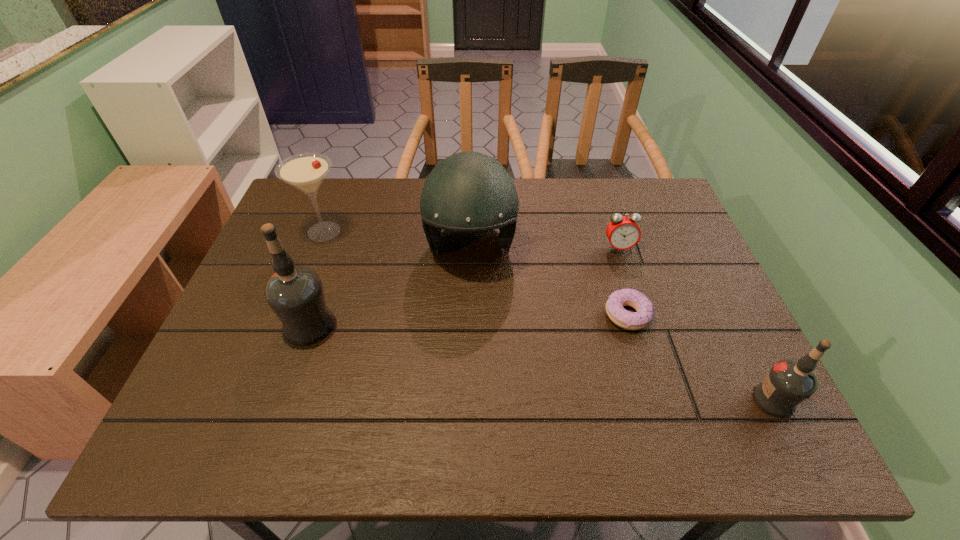
At what (x,y) coordinates should I click in order to perform the action: click on free space that is in between the shortest object and the taller vodka. Please return your answer as a coordinate pair (x, y). The image size is (960, 540). Looking at the image, I should click on (468, 320).

Identify which object is the nearest to the shortest object. Please provide its 2D coordinates. Your answer should be formatted as a tuple, i.e. [(x, y)], where the tuple contains the x and y coordinates of a point satisfying the conditions above.

[(623, 233)]

You are a GUI agent. You are given a task and a screenshot of the screen. Output one action in this format:
    pyautogui.click(x=<x>, y=<y>)
    Task: Click on the fifth closest object to the left vodka
    This screenshot has width=960, height=540.
    Given the screenshot: What is the action you would take?
    pyautogui.click(x=788, y=383)

Locate an element on the screen. Image resolution: width=960 pixels, height=540 pixels. vacant area in the image that satisfies the following two spatial constraints: 1. on the front-facing side of the alarm clock; 2. on the front label of the taller vodka is located at coordinates (643, 325).

What are the coordinates of `vacant space that satisfies the following two spatial constraints: 1. on the front-facing side of the fifth tallest object; 2. on the front label of the farther vodka` in the screenshot? It's located at (643, 325).

The height and width of the screenshot is (540, 960). I want to click on free location that satisfies the following two spatial constraints: 1. on the front side of the doughnut; 2. on the right side of the martini, so click(x=293, y=315).

Locate an element on the screen. The width and height of the screenshot is (960, 540). vacant space that satisfies the following two spatial constraints: 1. at the face opening of the shortest object; 2. on the left side of the fourth object from right to left is located at coordinates (468, 315).

At what (x,y) coordinates should I click in order to perform the action: click on vacant space that satisfies the following two spatial constraints: 1. at the face opening of the fourth object from right to left; 2. on the front label of the taller vodka. Please return your answer as a coordinate pair (x, y). This screenshot has height=540, width=960. Looking at the image, I should click on (468, 325).